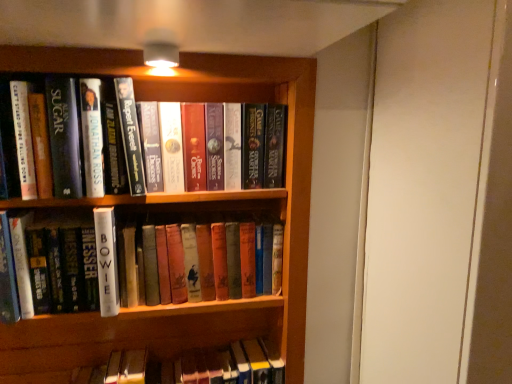
Question: In which direction should I rotate to look at white matte book at center, the 1th book when ordered from bottom to top?

Choices:
 (A) left
 (B) right

Answer: (A)

Question: Considering the relative sizes of white matte book at center, which ranks as the 3th book in top-to-bottom order, and hardcover books at center, the 1th book from the top, in the image provided, is white matte book at center, which ranks as the 3th book in top-to-bottom order, wider than hardcover books at center, the 1th book from the top,?

Choices:
 (A) yes
 (B) no

Answer: (B)

Question: Does white matte book at center, the 1th book when ordered from bottom to top, have a lesser width compared to hardcover books at center, the 1th book from the top?

Choices:
 (A) no
 (B) yes

Answer: (B)

Question: Is white matte book at center, the 1th book when ordered from bottom to top, not inside hardcover books at center, positioned as the 3th book in bottom-to-top order?

Choices:
 (A) no
 (B) yes

Answer: (B)

Question: Does white matte book at center, which ranks as the 3th book in top-to-bottom order, lie behind hardcover books at center, positioned as the 3th book in bottom-to-top order?

Choices:
 (A) no
 (B) yes

Answer: (A)

Question: Is white matte book at center, which ranks as the 3th book in top-to-bottom order, positioned with its back to hardcover books at center, the 1th book from the top?

Choices:
 (A) no
 (B) yes

Answer: (A)

Question: From the image's perspective, is white matte book at center, the 1th book when ordered from bottom to top, under hardcover books at center, positioned as the 3th book in bottom-to-top order?

Choices:
 (A) no
 (B) yes

Answer: (B)

Question: Is white matte book at center, the 1th book when ordered from bottom to top, positioned in front of hardcover book at upper left, the second book when ordered from top to bottom?

Choices:
 (A) yes
 (B) no

Answer: (B)

Question: Considering the relative sizes of white matte book at center, which ranks as the 3th book in top-to-bottom order, and hardcover book at upper left, the second book when ordered from top to bottom, in the image provided, is white matte book at center, which ranks as the 3th book in top-to-bottom order, taller than hardcover book at upper left, the second book when ordered from top to bottom,?

Choices:
 (A) yes
 (B) no

Answer: (B)

Question: Can you confirm if white matte book at center, which ranks as the 3th book in top-to-bottom order, is positioned to the left of hardcover book at upper left, the second book when ordered from top to bottom?

Choices:
 (A) no
 (B) yes

Answer: (A)

Question: Are white matte book at center, which ranks as the 3th book in top-to-bottom order, and hardcover book at upper left, the second book when ordered from top to bottom, far apart?

Choices:
 (A) no
 (B) yes

Answer: (A)

Question: Is white matte book at center, which ranks as the 3th book in top-to-bottom order, in contact with hardcover book at upper left, the second book when ordered from top to bottom?

Choices:
 (A) yes
 (B) no

Answer: (B)

Question: Would you say white matte book at center, the 1th book when ordered from bottom to top, is outside hardcover book at upper left, which is the 2th book from bottom to top?

Choices:
 (A) no
 (B) yes

Answer: (B)

Question: Is hardcover books at center, the 1th book from the top, not close to white matte book at center, which ranks as the 3th book in top-to-bottom order?

Choices:
 (A) no
 (B) yes

Answer: (A)